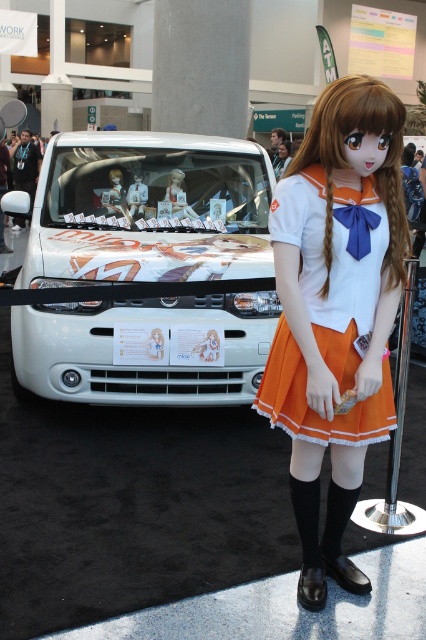
You are attending a convention and want to take a photo with both the white glossy car at center and the orange satin skirt at center. Since you need to ensure both are fully visible in the frame, which object should you position closer to the camera to achieve this?

To ensure both the white glossy car at center and the orange satin skirt at center are fully visible in the frame, you should position the orange satin skirt at center closer to the camera. Since the white glossy car at center is taller than the orange satin skirt at center, bringing the skirt forward will help balance their sizes in the photo.

You are at a convention and want to take a photo of the white glossy car at center and the matte plastic doll at center. Which object should you focus on first if you want to capture both in the same frame without moving the camera?

You should focus on the matte plastic doll at center first because the white glossy car at center is positioned to its right, so by centering the doll, the car will naturally fall into the frame on the right side.

You are at a convention and want to take a photo of both the white glossy car at center and the matte plastic doll at center. Since you can only focus on one object at a time, which one should you aim the camera at first to ensure the other is still in frame?

You should aim the camera at the white glossy car at center first because it is positioned below the matte plastic doll at center, so adjusting focus to the car will keep the doll in the upper part of the frame.